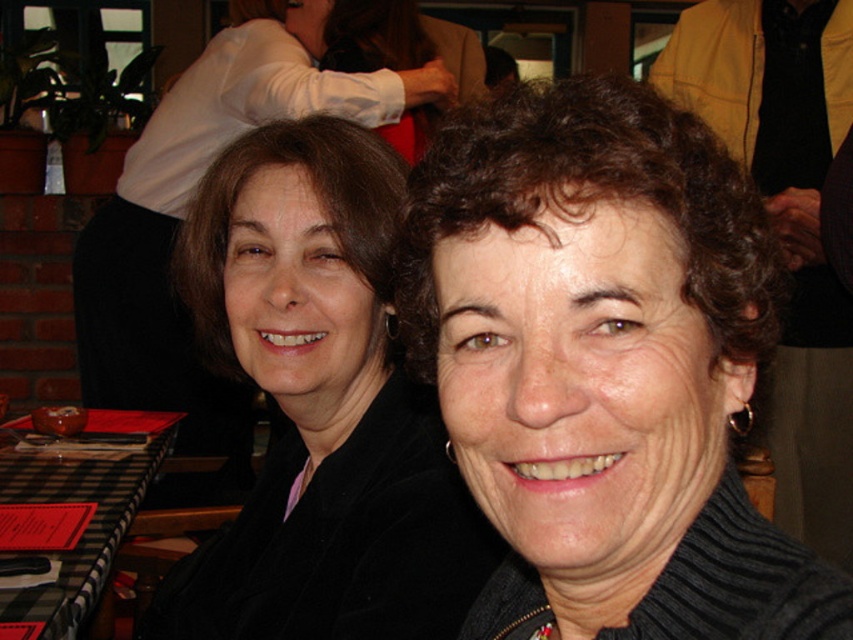
Does dark brown curly hair at center have a smaller size compared to matte black jacket at upper left?

Yes.

Who is more forward, (483, 260) or (410, 102)?

Positioned in front is point (483, 260).

At what (x,y) coordinates should I click in order to perform the action: click on dark brown curly hair at center. Please return your answer as a coordinate pair (x, y). Looking at the image, I should click on (602, 365).

Is the position of dark brown curly hair at center more distant than that of black velvet jacket at upper left?

No.

Find the location of a particular element. This screenshot has height=640, width=853. dark brown curly hair at center is located at coordinates tap(602, 365).

Is black velvet jacket at upper left to the left of black checkered tablecloth at lower left from the viewer's perspective?

Incorrect, black velvet jacket at upper left is not on the left side of black checkered tablecloth at lower left.

Locate an element on the screen. The image size is (853, 640). black velvet jacket at upper left is located at coordinates (318, 406).

Is point (386, 516) positioned before point (62, 589)?

Yes, point (386, 516) is in front of point (62, 589).

At what (x,y) coordinates should I click in order to perform the action: click on black velvet jacket at upper left. Please return your answer as a coordinate pair (x, y). This screenshot has height=640, width=853. Looking at the image, I should click on (318, 406).